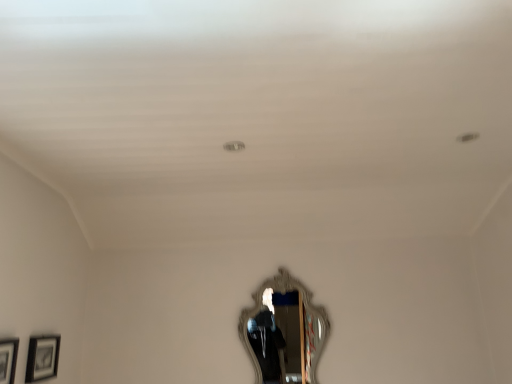
Question: Does silver ornate mirror at center touch matte black picture frame at lower left, which is the 2th picture frame in back-to-front order?

Choices:
 (A) no
 (B) yes

Answer: (A)

Question: Does silver ornate mirror at center have a greater width compared to matte black picture frame at lower left, which is the 2th picture frame in back-to-front order?

Choices:
 (A) no
 (B) yes

Answer: (B)

Question: Is silver ornate mirror at center to the left of matte black picture frame at lower left, which is the 2th picture frame in back-to-front order, from the viewer's perspective?

Choices:
 (A) no
 (B) yes

Answer: (A)

Question: Does silver ornate mirror at center have a lesser height compared to matte black picture frame at lower left, the first picture frame from the front?

Choices:
 (A) no
 (B) yes

Answer: (A)

Question: Does silver ornate mirror at center have a lesser width compared to matte black picture frame at lower left, which is the 2th picture frame in back-to-front order?

Choices:
 (A) yes
 (B) no

Answer: (B)

Question: Is silver ornate mirror at center in front of matte black picture frame at lower left, which is the 2th picture frame in back-to-front order?

Choices:
 (A) yes
 (B) no

Answer: (B)

Question: Is the depth of matte black picture frame at lower left, the 1th picture frame from the back, greater than that of matte black picture frame at lower left, which is the 2th picture frame in back-to-front order?

Choices:
 (A) yes
 (B) no

Answer: (A)

Question: Does matte black picture frame at lower left, marked as the second picture frame in a front-to-back arrangement, have a larger size compared to matte black picture frame at lower left, which is the 2th picture frame in back-to-front order?

Choices:
 (A) yes
 (B) no

Answer: (B)

Question: Considering the relative sizes of matte black picture frame at lower left, the 1th picture frame from the back, and matte black picture frame at lower left, which is the 2th picture frame in back-to-front order, in the image provided, is matte black picture frame at lower left, the 1th picture frame from the back, thinner than matte black picture frame at lower left, which is the 2th picture frame in back-to-front order,?

Choices:
 (A) yes
 (B) no

Answer: (A)

Question: Considering the relative sizes of matte black picture frame at lower left, marked as the second picture frame in a front-to-back arrangement, and matte black picture frame at lower left, which is the 2th picture frame in back-to-front order, in the image provided, is matte black picture frame at lower left, marked as the second picture frame in a front-to-back arrangement, taller than matte black picture frame at lower left, which is the 2th picture frame in back-to-front order,?

Choices:
 (A) no
 (B) yes

Answer: (A)

Question: Considering the relative sizes of matte black picture frame at lower left, marked as the second picture frame in a front-to-back arrangement, and matte black picture frame at lower left, the first picture frame from the front, in the image provided, is matte black picture frame at lower left, marked as the second picture frame in a front-to-back arrangement, smaller than matte black picture frame at lower left, the first picture frame from the front,?

Choices:
 (A) yes
 (B) no

Answer: (A)

Question: Is matte black picture frame at lower left, marked as the second picture frame in a front-to-back arrangement, not near matte black picture frame at lower left, the first picture frame from the front?

Choices:
 (A) no
 (B) yes

Answer: (A)

Question: Is matte black picture frame at lower left, which is the 2th picture frame in back-to-front order, positioned before silver ornate mirror at center?

Choices:
 (A) no
 (B) yes

Answer: (B)